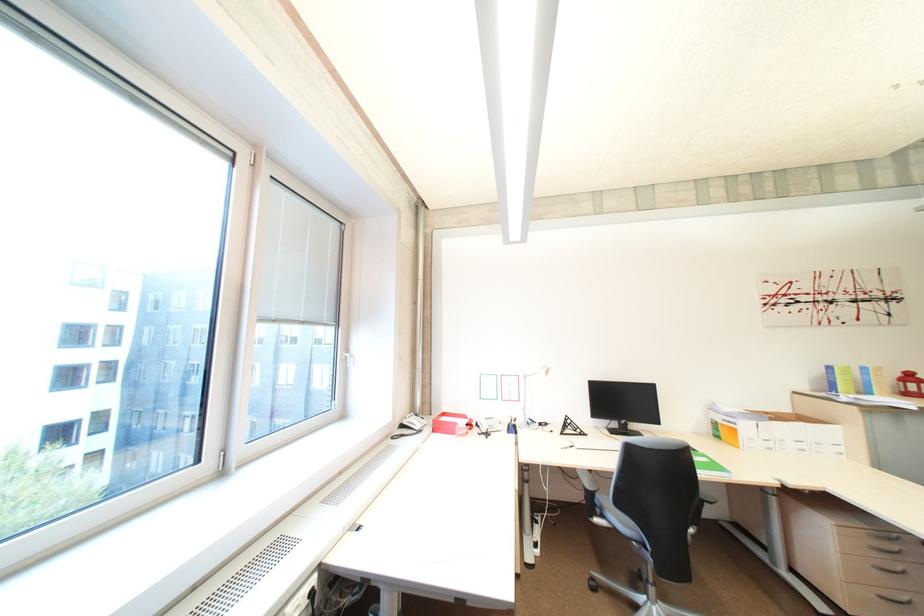
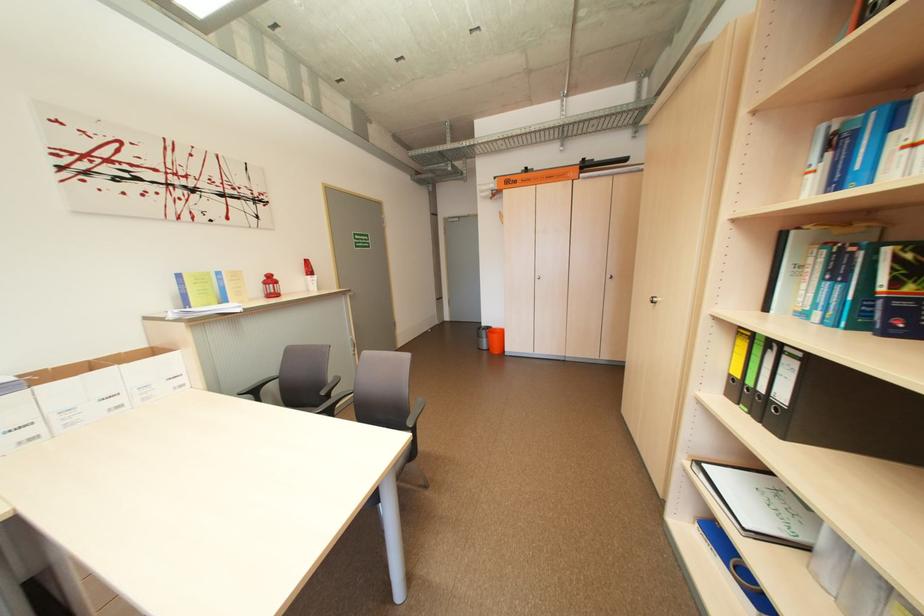
In the second image, find the point that corresponds to the point at 782,419 in the first image.

(43, 384)